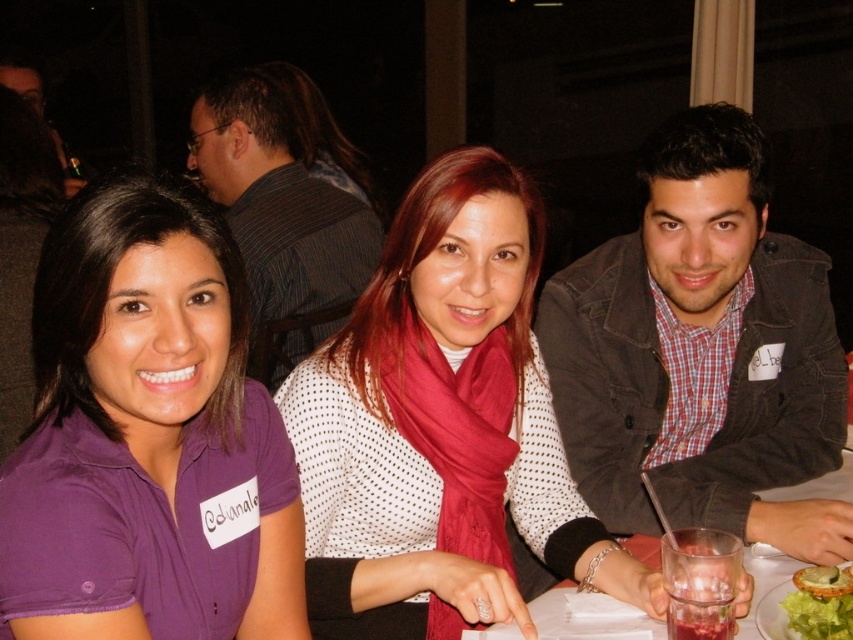
Question: Among these objects, which one is nearest to the camera?

Choices:
 (A) dark gray jacket at right
 (B) green leafy lettuce at lower right

Answer: (B)

Question: Is dark gray jacket at right further to camera compared to green leafy lettuce at lower right?

Choices:
 (A) no
 (B) yes

Answer: (B)

Question: Which object is farther from the camera taking this photo?

Choices:
 (A) white dotted shirt at center
 (B) striped shirt at center
 (C) clear glass at center

Answer: (B)

Question: Which of the following is the closest to the observer?

Choices:
 (A) green leafy lettuce at lower right
 (B) white dotted shirt at center
 (C) purple cotton shirt at left

Answer: (C)

Question: Observing the image, what is the correct spatial positioning of white dotted shirt at center in reference to clear glass at center?

Choices:
 (A) right
 (B) left

Answer: (B)

Question: Does purple cotton shirt at left appear on the left side of dark gray jacket at right?

Choices:
 (A) no
 (B) yes

Answer: (B)